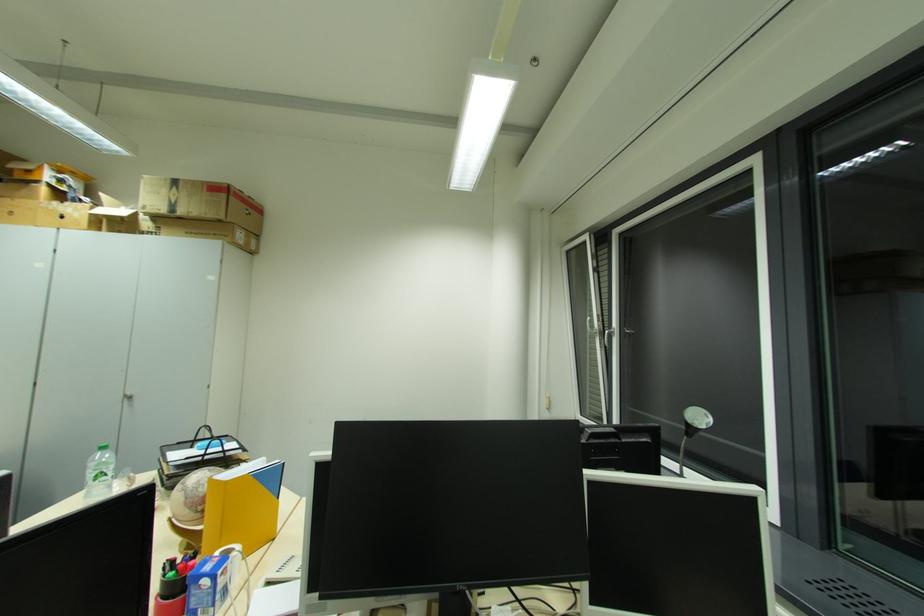
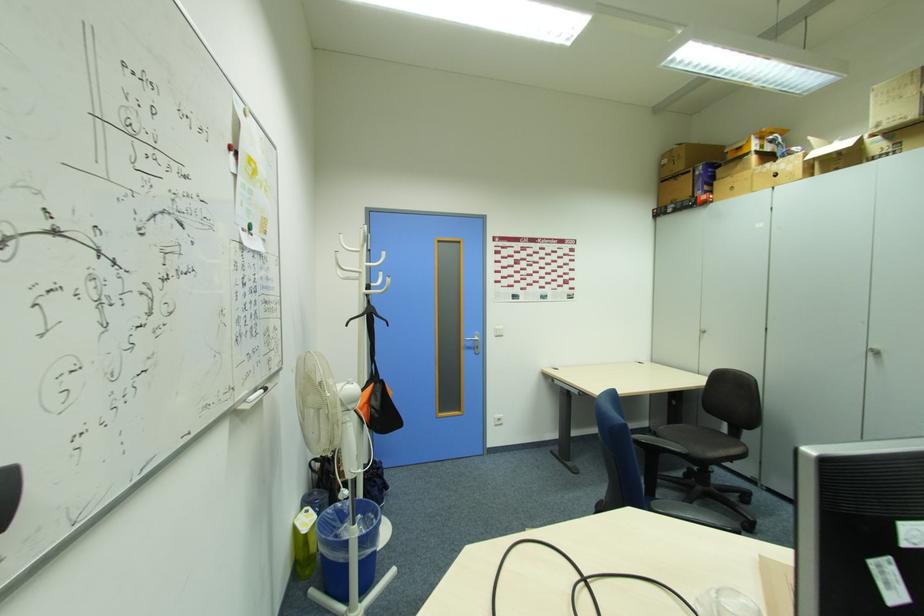
In the second image, find the point that corresponds to the point at 131,399 in the first image.

(880, 354)